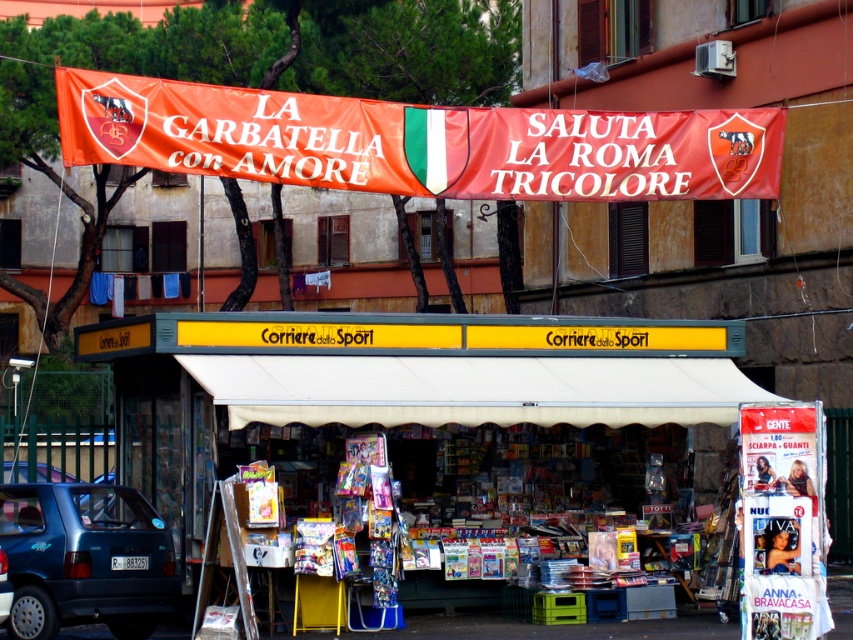
Question: Can you confirm if yellow corrugated metal kiosk at center is positioned below metallic blue car at lower left?

Choices:
 (A) yes
 (B) no

Answer: (B)

Question: Which object is positioned closest to the yellow corrugated metal kiosk at center?

Choices:
 (A) orange fabric banner at upper center
 (B) metallic blue car at lower left

Answer: (A)

Question: Where is orange fabric banner at upper center located in relation to metallic blue car at lower left in the image?

Choices:
 (A) below
 (B) above

Answer: (B)

Question: Estimate the real-world distances between objects in this image. Which object is closer to the orange fabric banner at upper center?

Choices:
 (A) metallic blue car at lower left
 (B) yellow corrugated metal kiosk at center

Answer: (A)

Question: Which object is the closest to the orange fabric banner at upper center?

Choices:
 (A) metallic blue car at lower left
 (B) yellow corrugated metal kiosk at center

Answer: (A)

Question: Can you confirm if orange fabric banner at upper center is positioned above metallic blue car at lower left?

Choices:
 (A) no
 (B) yes

Answer: (B)